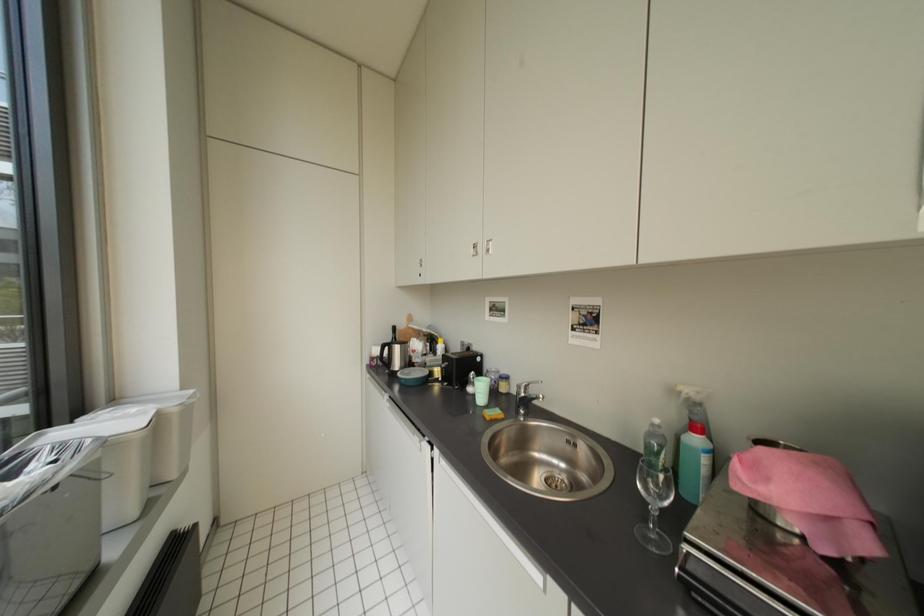
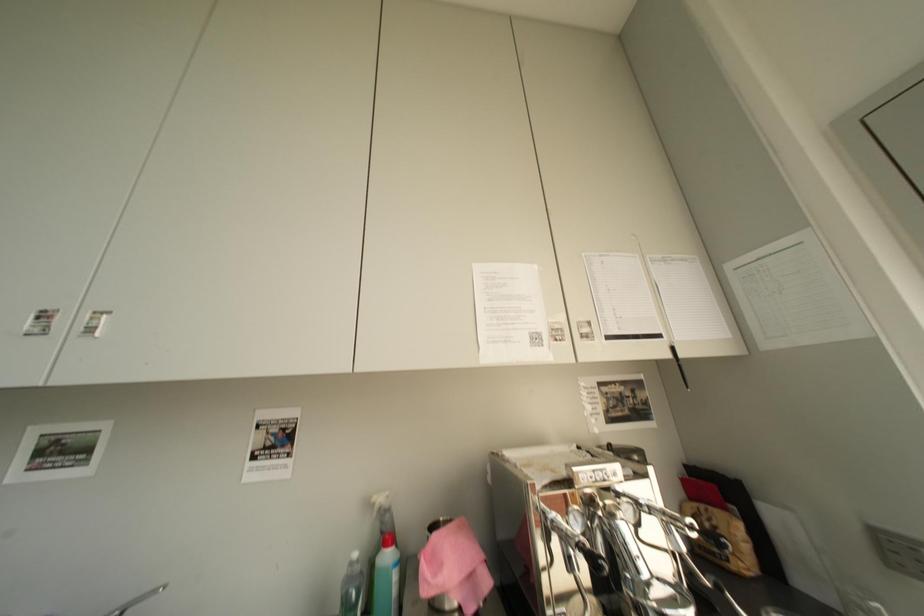
The first image is from the beginning of the video and the second image is from the end. How did the camera likely rotate when shooting the video?

The camera rotated toward right-up.